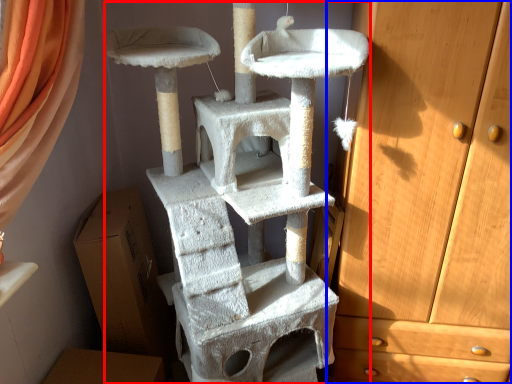
Question: Which object appears farthest to the camera in this image, bunk bed (highlighted by a red box) or chest of drawers (highlighted by a blue box)?

Choices:
 (A) bunk bed
 (B) chest of drawers

Answer: (B)